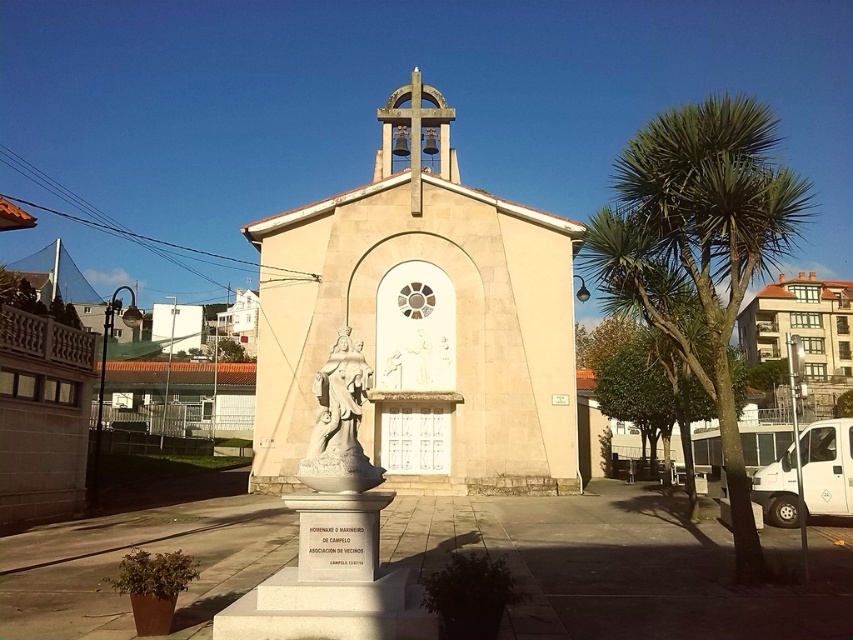
Question: Can you confirm if beige stone chapel at center is smaller than white stone statue at center?

Choices:
 (A) no
 (B) yes

Answer: (A)

Question: Can you confirm if beige stone church at center is positioned to the left of white stone statue at center?

Choices:
 (A) yes
 (B) no

Answer: (B)

Question: Which point is closer to the camera taking this photo?

Choices:
 (A) (827, 333)
 (B) (459, 428)
 (C) (358, 472)

Answer: (C)

Question: Can you confirm if green leafy palm tree at right is positioned to the left of white stone statue at center?

Choices:
 (A) no
 (B) yes

Answer: (A)

Question: Which of the following is the closest to the observer?

Choices:
 (A) (341, 433)
 (B) (548, 312)

Answer: (A)

Question: Which point is closer to the camera?

Choices:
 (A) (741, 349)
 (B) (560, 294)

Answer: (B)